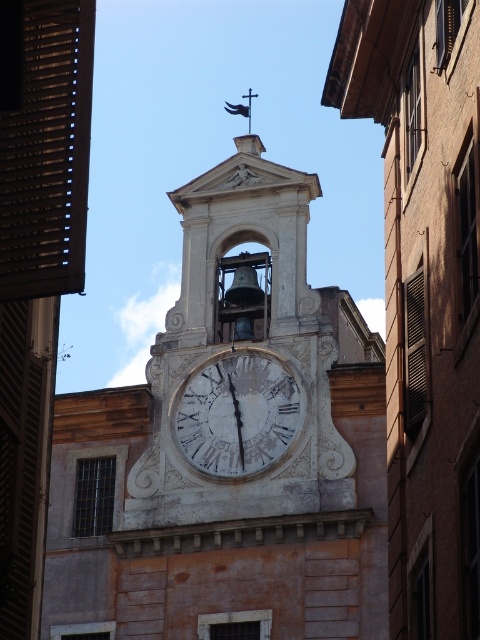
Who is more forward, [194,420] or [260,436]?

Point [260,436]

Is white stone clock at center in front of white marble clock at center?

Yes, it is.

The width and height of the screenshot is (480, 640). Describe the element at coordinates (228, 445) in the screenshot. I see `white stone clock at center` at that location.

Where is `white stone clock at center`? white stone clock at center is located at coordinates (228, 445).